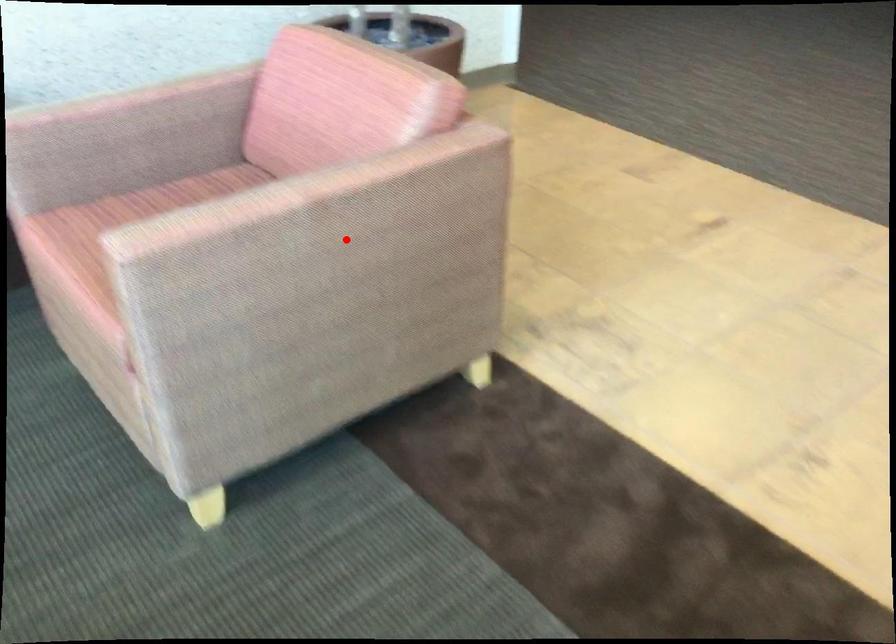
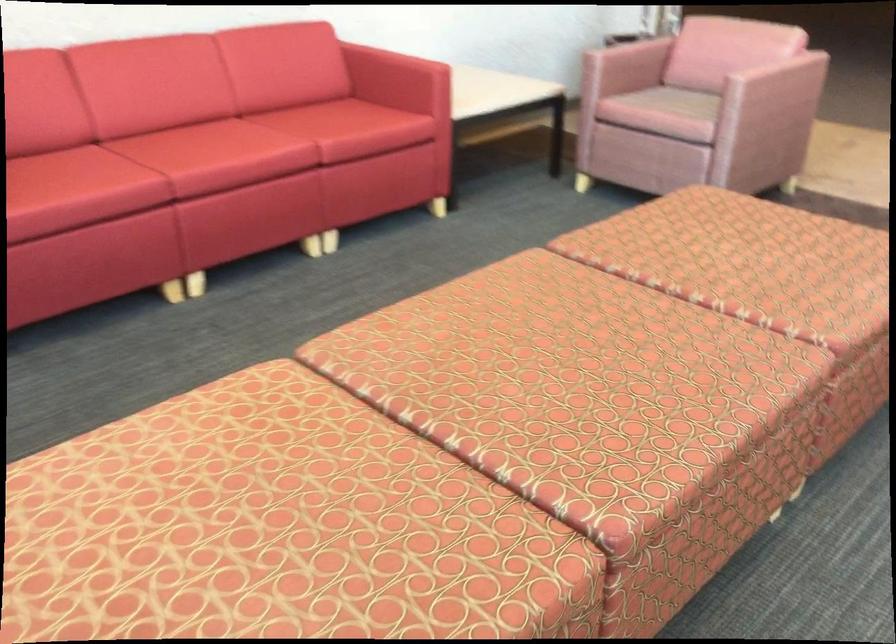
Question: I am providing you with two images of the same scene from different viewpoints. Image1 has a red point marked. In image2, the corresponding 3D location appears at what relative position? Reply with the corresponding letter.

Choices:
 (A) Closer
 (B) Farther

Answer: (B)